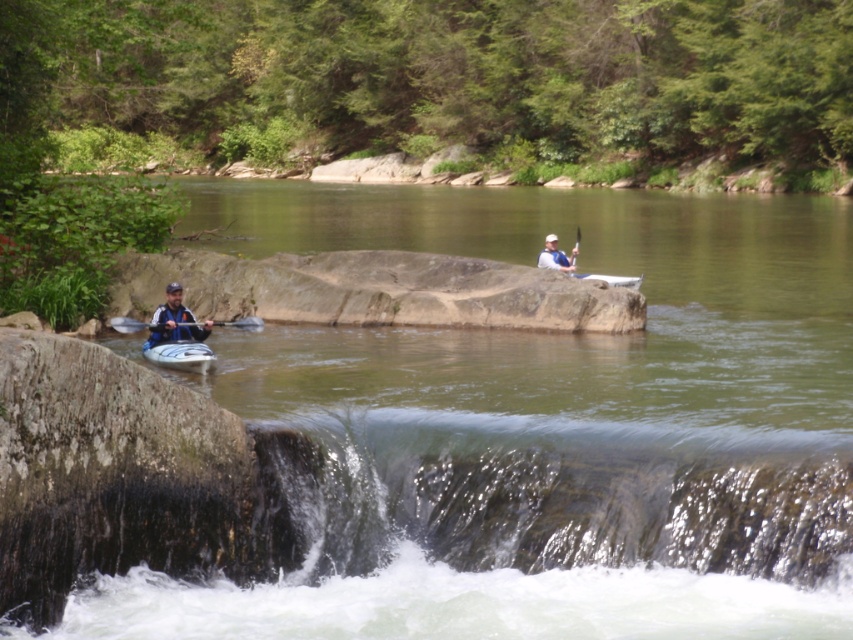
Is green smooth river at center wider than smooth blue paddle at upper center?

Yes, green smooth river at center is wider than smooth blue paddle at upper center.

Can you confirm if green smooth river at center is taller than smooth blue paddle at upper center?

Indeed, green smooth river at center has a greater height compared to smooth blue paddle at upper center.

Identify the location of green smooth river at center. pyautogui.click(x=544, y=429).

Where is `green smooth river at center`? green smooth river at center is located at coordinates (544, 429).

Does green smooth river at center have a smaller size compared to blue plastic paddle at left?

Actually, green smooth river at center might be larger than blue plastic paddle at left.

Who is shorter, green smooth river at center or blue plastic paddle at left?

With less height is blue plastic paddle at left.

Is point (567, 371) positioned behind point (254, 316)?

No, it is not.

Where is `green smooth river at center`? This screenshot has width=853, height=640. green smooth river at center is located at coordinates (544, 429).

Is matte blue kayak at left taller than blue plastic paddle at left?

Yes, matte blue kayak at left is taller than blue plastic paddle at left.

Is point (177, 310) more distant than point (114, 328)?

No, it is in front of (114, 328).

Between point (165, 294) and point (146, 323), which one is positioned in front?

Point (165, 294) is more forward.

The height and width of the screenshot is (640, 853). Identify the location of matte blue kayak at left. (173, 321).